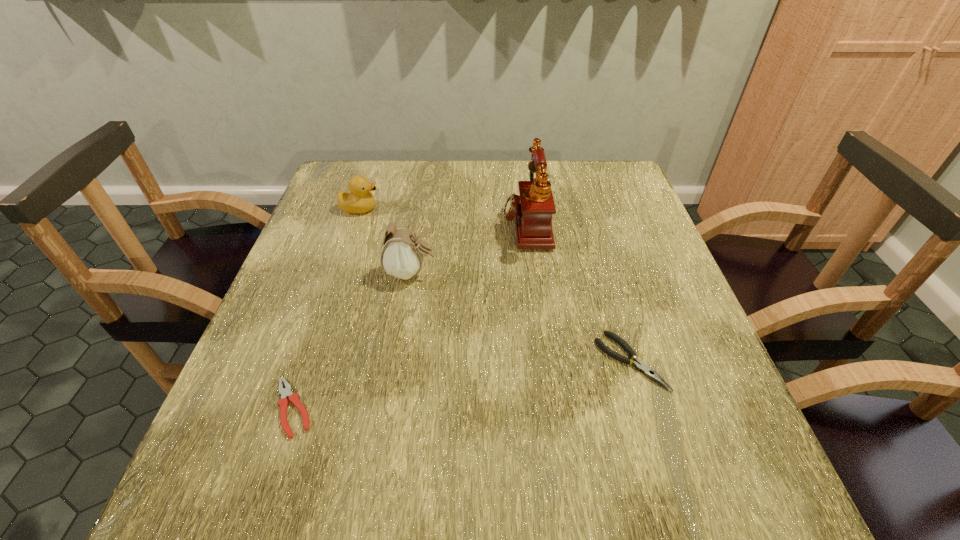
The image size is (960, 540). What are the coordinates of `vacant space that satisfies the following two spatial constraints: 1. on the back side of the right pliers; 2. on the dial of the tallest object` in the screenshot? It's located at (589, 224).

What are the coordinates of `vacant space that satisfies the following two spatial constraints: 1. on the face of the duckling; 2. on the back side of the right pliers` in the screenshot? It's located at (309, 361).

Identify the location of vacant area in the image that satisfies the following two spatial constraints: 1. on the back side of the left pliers; 2. on the right side of the fourth tallest object. click(x=309, y=361).

I want to click on free space that satisfies the following two spatial constraints: 1. on the back side of the shorter pliers; 2. on the face of the duckling, so click(360, 208).

Where is `vacant point that satisfies the following two spatial constraints: 1. on the back side of the second shortest object; 2. on the front-facing side of the fourth shortest object`? The width and height of the screenshot is (960, 540). vacant point that satisfies the following two spatial constraints: 1. on the back side of the second shortest object; 2. on the front-facing side of the fourth shortest object is located at coordinates (605, 273).

Identify the location of vacant position in the image that satisfies the following two spatial constraints: 1. on the front-facing side of the fourth tallest object; 2. on the right side of the pouch. (396, 361).

The height and width of the screenshot is (540, 960). Find the location of `vacant position in the image that satisfies the following two spatial constraints: 1. on the face of the duckling; 2. on the left side of the rightmost object`. vacant position in the image that satisfies the following two spatial constraints: 1. on the face of the duckling; 2. on the left side of the rightmost object is located at coordinates (309, 361).

At what (x,y) coordinates should I click in order to perform the action: click on free spot that satisfies the following two spatial constraints: 1. on the face of the third shortest object; 2. on the back side of the shortest object. Please return your answer as a coordinate pair (x, y). The height and width of the screenshot is (540, 960). Looking at the image, I should click on (293, 408).

In order to click on vacant area that satisfies the following two spatial constraints: 1. on the back side of the rightmost object; 2. on the dial of the telephone in this screenshot , I will do `click(589, 224)`.

What are the coordinates of `free space that satisfies the following two spatial constraints: 1. on the face of the third tallest object; 2. on the left side of the taller pliers` in the screenshot? It's located at (309, 361).